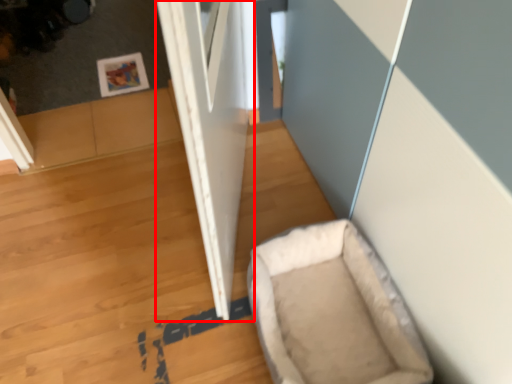
Question: From the image's perspective, considering the relative positions of door (annotated by the red box) and dog bed in the image provided, where is door (annotated by the red box) located with respect to the staircase?

Choices:
 (A) below
 (B) above

Answer: (B)